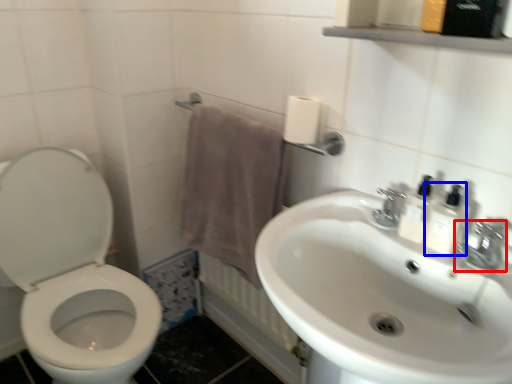
Question: Among these objects, which one is nearest to the camera, tap (highlighted by a red box) or mouthwash (highlighted by a blue box)?

Choices:
 (A) tap
 (B) mouthwash

Answer: (A)